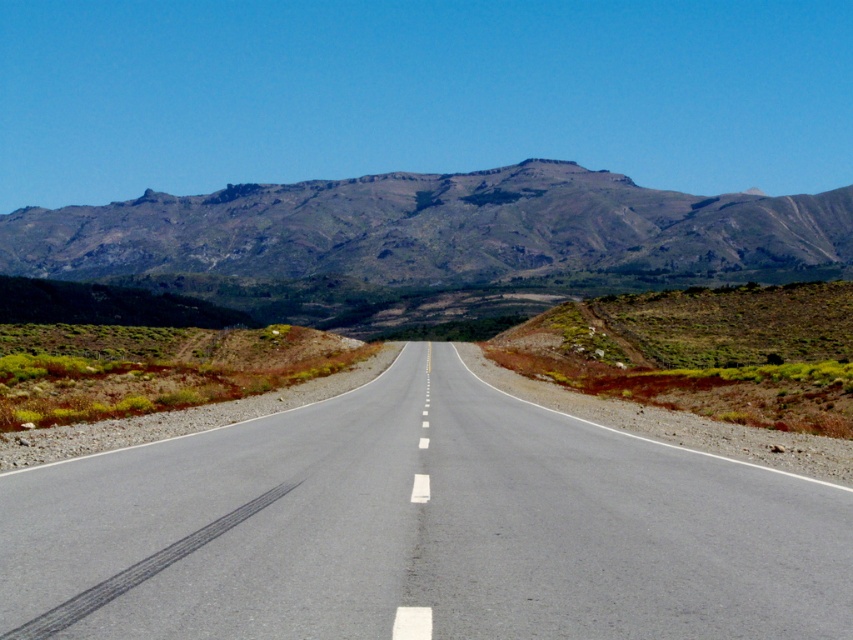
You are a drone operator trying to capture aerial shots of the road. You have two points marked on your map for drone takeoff and landing. The first point is at point (x=426, y=477) and the second is at point (x=183, y=282). Which point is closer to you when you start your operation?

Point (x=426, y=477) is closer to the viewer than point (x=183, y=282), so the first point is closer.

You are driving a car and see the asphalt road at center and the gray rocky mountain range at upper center. Which object is positioned to the right side of the other?

The asphalt road at center is to the right of gray rocky mountain range at upper center.

You are standing at the edge of the asphalt road at center. You want to walk to a point exactly 5 meters away from where you are standing. Can you reach that point by walking straight ahead along the road?

The distance between you and the asphalt road at center is 4.90 meters. If you walk straight ahead along the road, you can reach a point just 0.10 meters short of the 5 meters target distance.